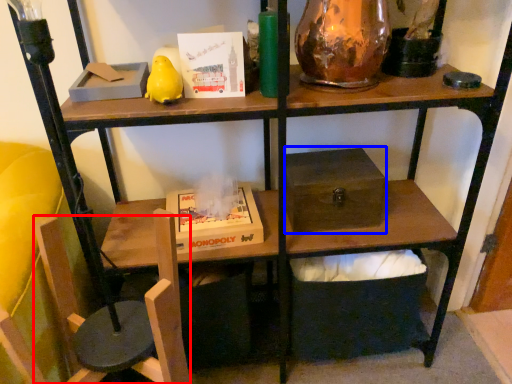
Question: Which point is further to the camera, swivel chair (highlighted by a red box) or box (highlighted by a blue box)?

Choices:
 (A) swivel chair
 (B) box

Answer: (B)